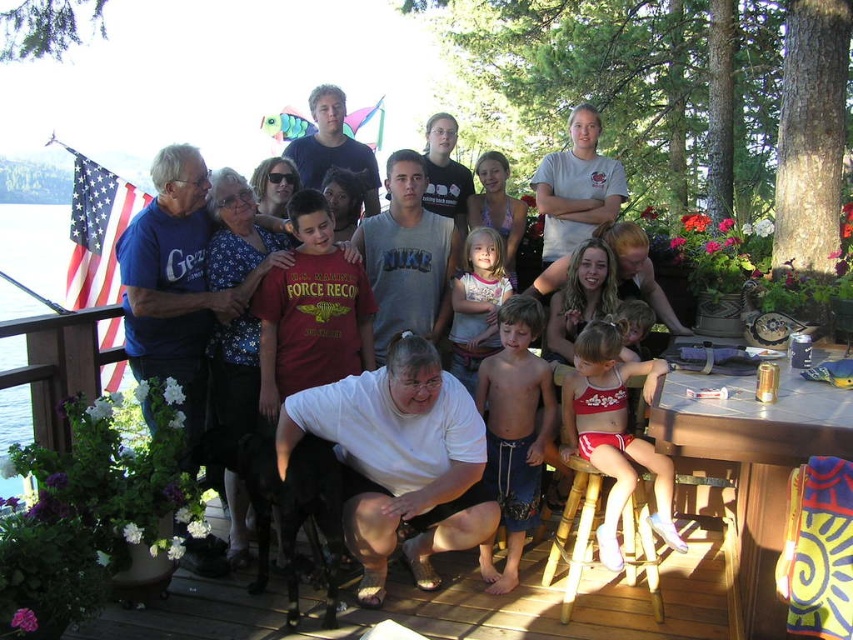
Question: Among these objects, which one is nearest to the camera?

Choices:
 (A) white matte shirt at center
 (B) wooden deck at center

Answer: (B)

Question: Considering the relative positions of wooden deck at center and wooden table at lower right in the image provided, where is wooden deck at center located with respect to wooden table at lower right?

Choices:
 (A) below
 (B) above

Answer: (A)

Question: Is white cotton shirt at center positioned at the back of striped cotton shirt at center?

Choices:
 (A) no
 (B) yes

Answer: (A)

Question: Is wooden deck at center positioned behind striped cotton shirt at center?

Choices:
 (A) no
 (B) yes

Answer: (A)

Question: Which point is closer to the camera?

Choices:
 (A) (479, 376)
 (B) (619, 280)

Answer: (A)

Question: Which point appears farthest from the camera in this image?

Choices:
 (A) (827, 412)
 (B) (532, 180)
 (C) (500, 301)
 (D) (271, 609)

Answer: (B)